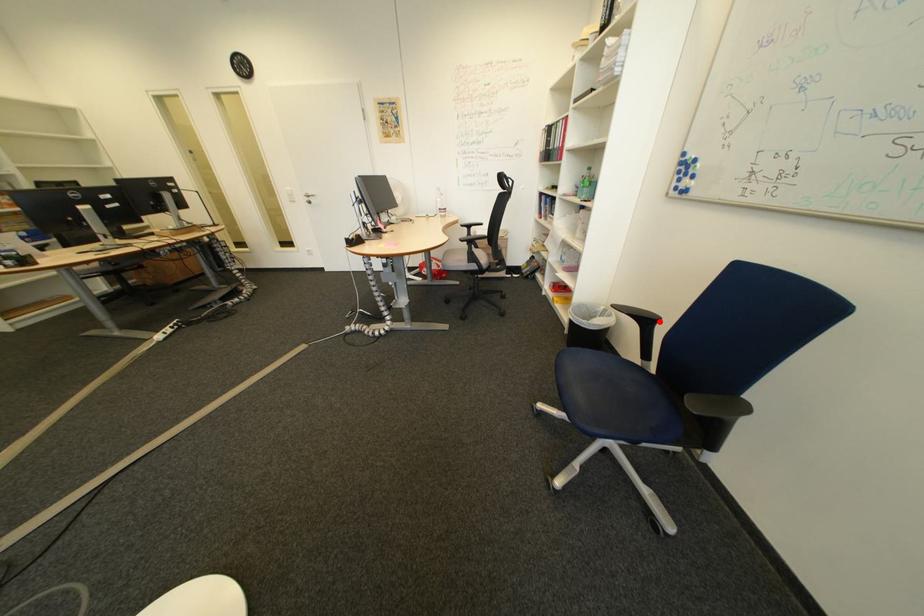
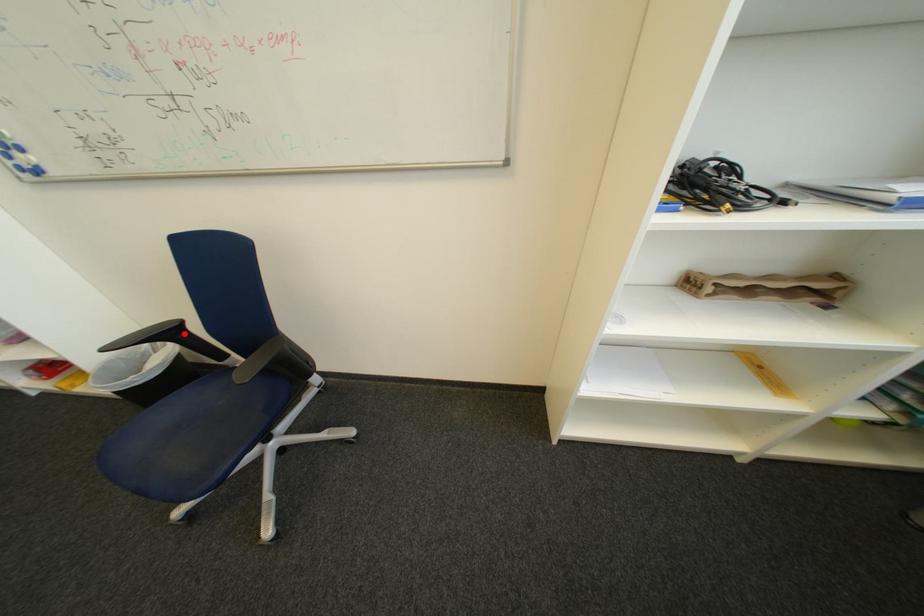
I am providing you with two images of the same scene from different viewpoints. A red point is marked on the first image and another point is marked on the second image. Does the point marked in image1 correspond to the same location as the one in image2?

Yes